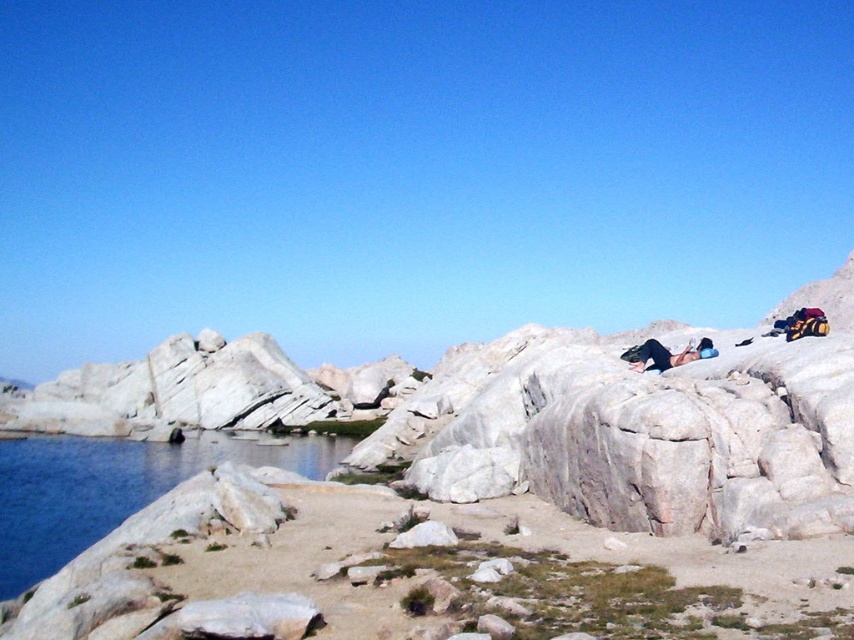
Question: Which object appears farthest from the camera in this image?

Choices:
 (A) black fabric person at center
 (B) blue smooth water at lower left

Answer: (A)

Question: Which object is farther from the camera taking this photo?

Choices:
 (A) blue smooth water at lower left
 (B) black fabric person at center

Answer: (B)

Question: Is blue smooth water at lower left below black fabric person at center?

Choices:
 (A) yes
 (B) no

Answer: (A)

Question: Which point is farther to the camera?

Choices:
 (A) (711, 352)
 (B) (3, 556)

Answer: (A)

Question: Does blue smooth water at lower left appear under black fabric person at center?

Choices:
 (A) no
 (B) yes

Answer: (B)

Question: Is blue smooth water at lower left wider than black fabric person at center?

Choices:
 (A) no
 (B) yes

Answer: (B)